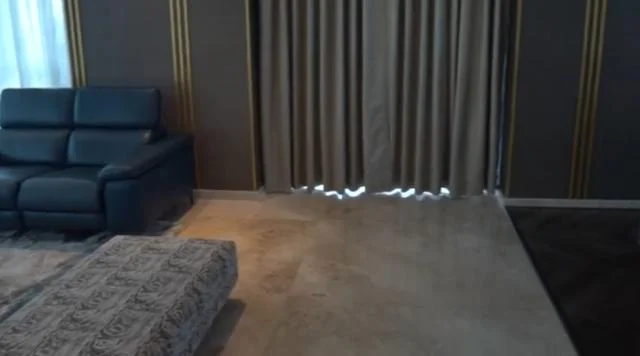
The height and width of the screenshot is (356, 640). Find the location of `curtain`. curtain is located at coordinates (306, 167).